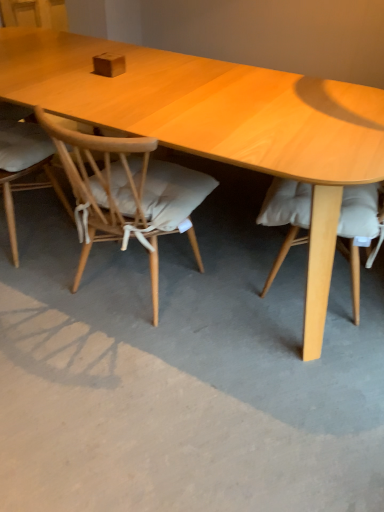
Where is `free space to the right of light wood chair at center, the second chair viewed from the left`? The height and width of the screenshot is (512, 384). free space to the right of light wood chair at center, the second chair viewed from the left is located at coordinates click(233, 301).